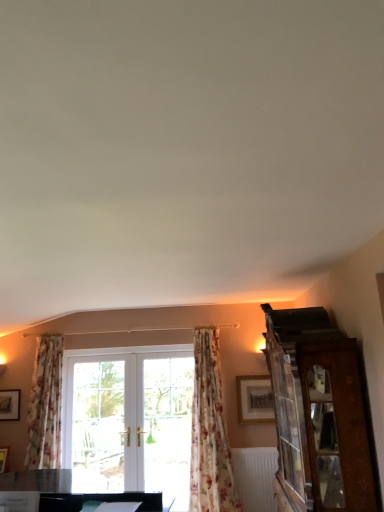
Question: Is the depth of wooden picture frame at lower left, the second picture frame positioned from the right, less than that of wooden cabinet at right?

Choices:
 (A) no
 (B) yes

Answer: (A)

Question: Is wooden picture frame at lower left, the second picture frame positioned from the right, located outside wooden cabinet at right?

Choices:
 (A) yes
 (B) no

Answer: (A)

Question: Is wooden picture frame at lower left, which is the 1th picture frame from left to right, at the right side of wooden cabinet at right?

Choices:
 (A) yes
 (B) no

Answer: (B)

Question: Does wooden picture frame at lower left, which is the 1th picture frame from left to right, have a greater width compared to wooden cabinet at right?

Choices:
 (A) no
 (B) yes

Answer: (A)

Question: Is wooden picture frame at lower left, the first picture frame viewed from the back, facing towards wooden cabinet at right?

Choices:
 (A) yes
 (B) no

Answer: (B)

Question: Is point (276, 486) closer or farther from the camera than point (173, 381)?

Choices:
 (A) farther
 (B) closer

Answer: (B)

Question: From the image's perspective, relative to clear glass door at center, is wooden cabinet at right above or below?

Choices:
 (A) below
 (B) above

Answer: (B)

Question: Considering the positions of wooden cabinet at right and clear glass door at center in the image, is wooden cabinet at right bigger or smaller than clear glass door at center?

Choices:
 (A) small
 (B) big

Answer: (B)

Question: From a real-world perspective, is wooden cabinet at right positioned above or below clear glass door at center?

Choices:
 (A) above
 (B) below

Answer: (A)

Question: In the image, is white textured radiator at lower center positioned in front of or behind matte gold picture frame at upper right, which appears as the second picture frame when viewed from the left?

Choices:
 (A) front
 (B) behind

Answer: (A)

Question: Is white textured radiator at lower center wider or thinner than matte gold picture frame at upper right, the first picture frame viewed from the front?

Choices:
 (A) wide
 (B) thin

Answer: (A)

Question: Based on their sizes in the image, would you say white textured radiator at lower center is bigger or smaller than matte gold picture frame at upper right, the first picture frame viewed from the front?

Choices:
 (A) small
 (B) big

Answer: (B)

Question: Is white textured radiator at lower center inside the boundaries of matte gold picture frame at upper right, positioned as the 1th picture frame in right-to-left order, or outside?

Choices:
 (A) inside
 (B) outside

Answer: (B)

Question: From the image's perspective, is matte gold picture frame at upper right, the 2th picture frame when ordered from back to front, located above or below clear glass door at center?

Choices:
 (A) above
 (B) below

Answer: (A)

Question: Would you say matte gold picture frame at upper right, which appears as the second picture frame when viewed from the left, is inside or outside clear glass door at center?

Choices:
 (A) outside
 (B) inside

Answer: (A)